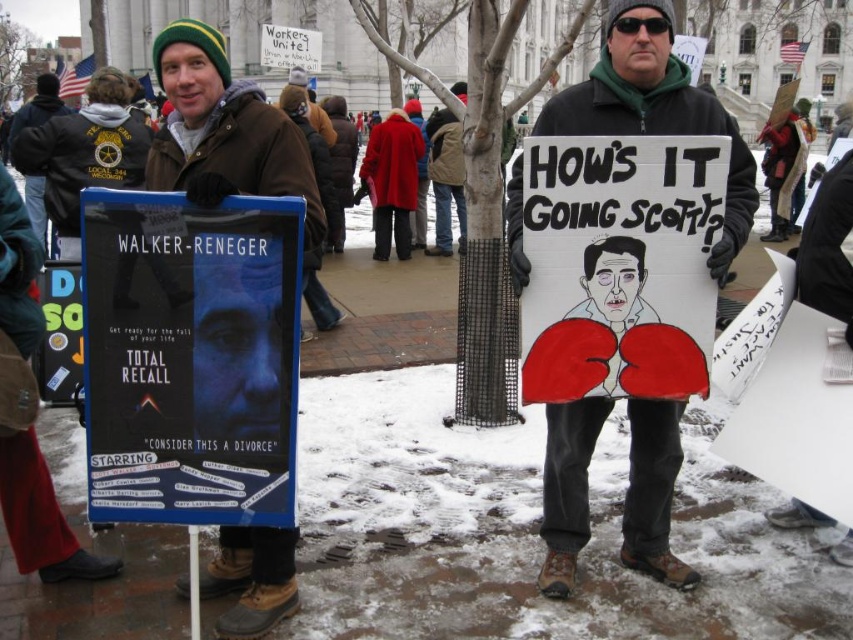
You are a photographer at the protest scene. You want to take a photo that includes both the white cardboard sign at center and the brown leather jacket at center. Considering their sizes, which object should you focus on first to ensure both are clearly visible in the frame?

The white cardboard sign at center has a lesser height compared to the brown leather jacket at center, so you should focus on the brown leather jacket at center first to ensure both are clearly visible in the frame.

You are a photographer trying to capture both the white cardboard sign at center and the matte black sign at center in the same frame. Considering their sizes, which sign will appear larger in the photo?

The matte black sign at center appears larger in the photo because it is taller than the white cardboard sign at center.

You are a photographer trying to capture a clear shot of both the white cardboard sign at center and the brown leather jacket at center in the protest scene. Based on their sizes in the image, which object should you focus on first to ensure it fits entirely within your camera frame?

The white cardboard sign at center occupies less space than the brown leather jacket at center, so you should focus on capturing the brown leather jacket at center first since it takes up more space and requires adjusting the frame to include its entire size.